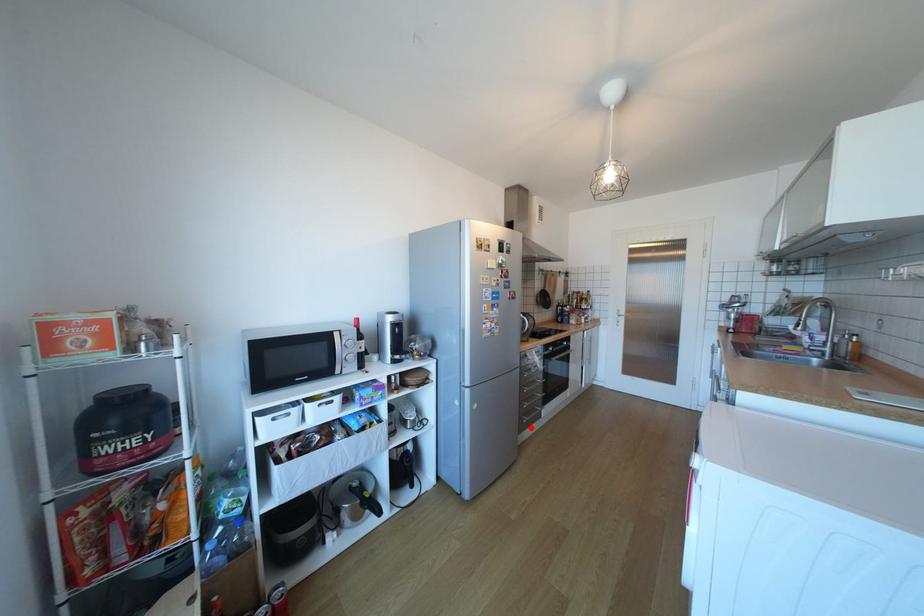
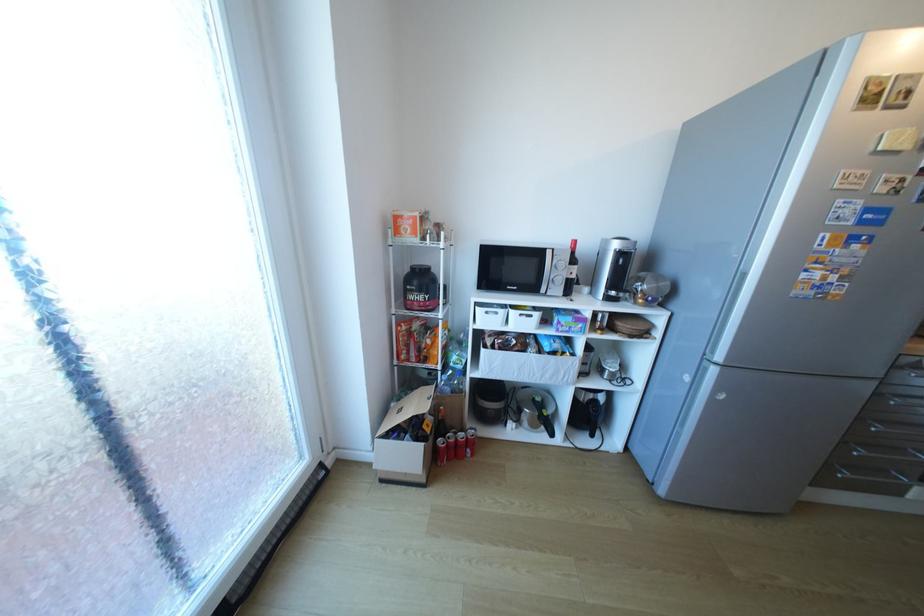
Question: I am providing you with two images of the same scene from different viewpoints. Given a red point in image1, look at the same physical point in image2. Is it:

Choices:
 (A) Closer to the viewpoint
 (B) Farther from the viewpoint

Answer: (A)